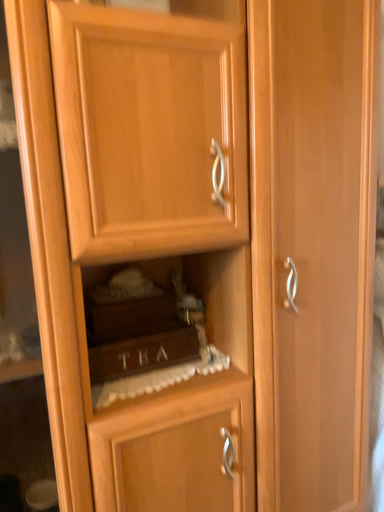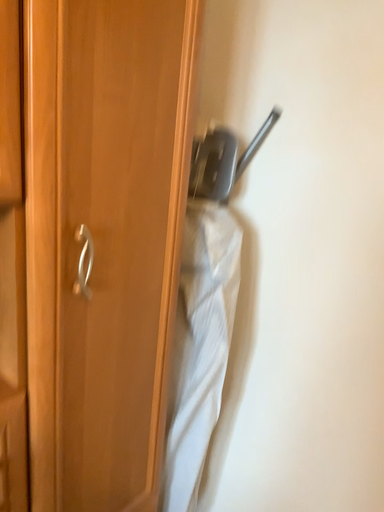
Question: How did the camera likely rotate when shooting the video?

Choices:
 (A) rotated left
 (B) rotated right

Answer: (B)